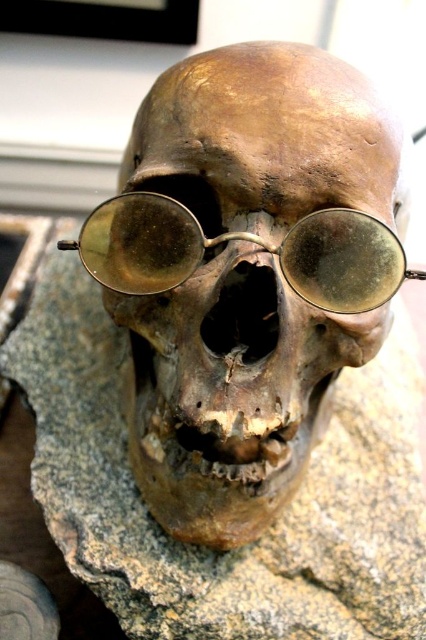
You are standing in front of a human skull placed on a rock surface. The skull has sunglasses over its eye sockets. A point at coordinates point (230, 392) is marked. Which object is located at that point?

The brown matte skull at center is located at point (230, 392).

Based on the photo, what is the exact coordinate of the brown rough stone at center in the image?

The brown rough stone at center is located at point (x=270, y=525).